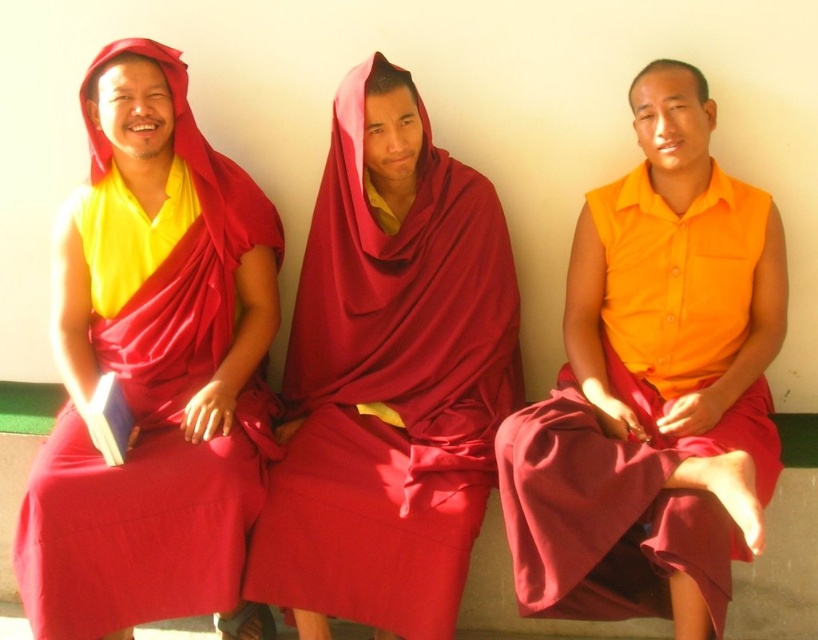
Who is shorter, orange matte vest at center or maroon silk robe at center?

orange matte vest at center

Is orange matte vest at center bigger than maroon silk robe at center?

Yes, orange matte vest at center is bigger than maroon silk robe at center.

This screenshot has width=818, height=640. Identify the location of orange matte vest at center. click(654, 387).

Can you confirm if matte red robe at left is thinner than maroon silk robe at center?

Correct, matte red robe at left's width is less than maroon silk robe at center's.

This screenshot has height=640, width=818. What are the coordinates of `matte red robe at left` in the screenshot? It's located at (153, 369).

Which is more to the left, matte red robe at left or orange matte vest at center?

matte red robe at left is more to the left.

Is matte red robe at left to the right of orange matte vest at center from the viewer's perspective?

No, matte red robe at left is not to the right of orange matte vest at center.

Locate an element on the screen. This screenshot has height=640, width=818. matte red robe at left is located at coordinates (153, 369).

Find the location of a particular element. The image size is (818, 640). matte red robe at left is located at coordinates (153, 369).